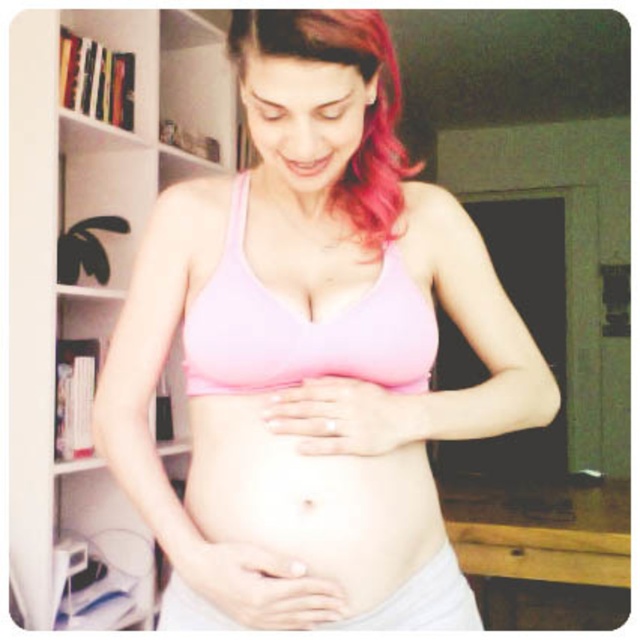
You are an interior designer planning to place a new decorative item between the white wooden bookshelf at left and the pink matte hair at upper center. Based on their positions, which object should the decorative item be closer to?

The decorative item should be closer to the pink matte hair at upper center because the white wooden bookshelf at left is positioned to the left of the pink matte hair at upper center, meaning the hair is further to the right, leaving more space between them towards the center.

You are designing a layout for a maternity clothing catalog and need to ensure that the product placement aligns with the model in the image. The model is wearing a matte pink bikini top at center and has pink matte hair at upper center. Based on the provided scene, which object occupies more horizontal space in the image?

The matte pink bikini top at center might be wider than pink matte hair at upper center, so it likely occupies more horizontal space in the image.

You are an interior designer analyzing the placement of furniture in the room. The pink matte bra at center is positioned at coordinates point 0.552, 0.487. Based on standard room dimensions, is this position likely within the living room area or the study area?

The pink matte bra at center is positioned at point (x=310, y=353). Since the background includes a bookshelf filled with books and various items, indicating a personal space, possibly a living room or study area, the coordinates suggest it is in the living room area.